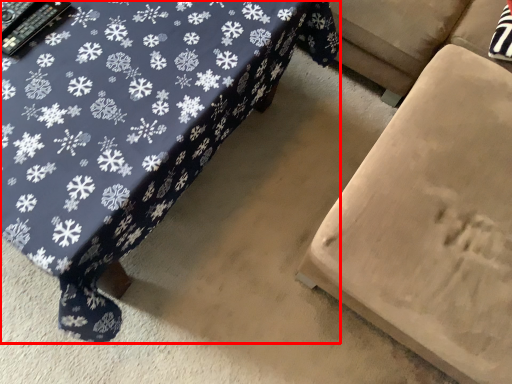
Question: From the image's perspective, where is table (annotated by the red box) located relative to furniture?

Choices:
 (A) below
 (B) above

Answer: (B)